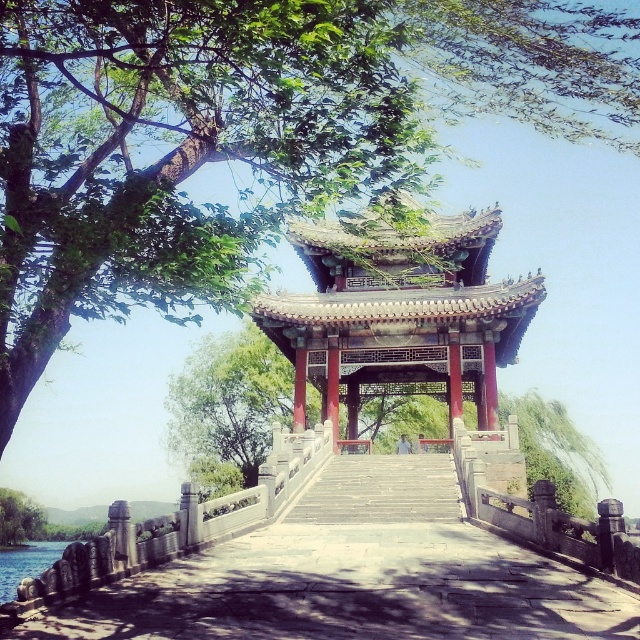
You are standing on the stone bridge leading to the pavilion and see the green leafy tree at center and the green leafy tree at lower left. From your perspective, which tree is positioned to the right side?

The green leafy tree at center is positioned to the right of the green leafy tree at lower left.